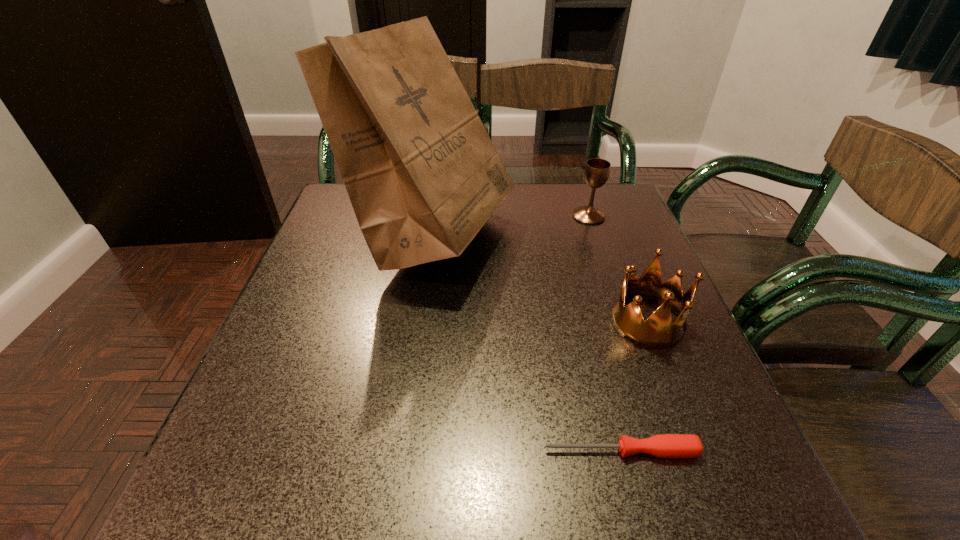
At what (x,y) coordinates should I click in order to perform the action: click on object present at the far right corner. Please return your answer as a coordinate pair (x, y). The width and height of the screenshot is (960, 540). Looking at the image, I should click on (597, 170).

Find the location of `object present at the near right corner`. object present at the near right corner is located at coordinates (664, 445).

In the image, there is a desktop. What are the coordinates of `vacant area at the far edge` in the screenshot? It's located at (499, 207).

The width and height of the screenshot is (960, 540). What are the coordinates of `free space at the near edge of the desktop` in the screenshot? It's located at (369, 507).

At what (x,y) coordinates should I click in order to perform the action: click on vacant space at the left edge of the desktop. Please return your answer as a coordinate pair (x, y). This screenshot has width=960, height=540. Looking at the image, I should click on (342, 295).

Find the location of a particular element. The image size is (960, 540). vacant space at the right edge of the desktop is located at coordinates (612, 344).

The width and height of the screenshot is (960, 540). What are the coordinates of `vacant area that lies between the chalice and the tallest object` in the screenshot? It's located at (512, 225).

Find the location of a particular element. The image size is (960, 540). free space between the chalice and the leftmost object is located at coordinates (512, 225).

At what (x,y) coordinates should I click in order to perform the action: click on free spot between the chalice and the leftmost object. Please return your answer as a coordinate pair (x, y). The height and width of the screenshot is (540, 960). Looking at the image, I should click on (512, 225).

Find the location of a particular element. The height and width of the screenshot is (540, 960). free space that is in between the chalice and the screwdriver is located at coordinates (605, 333).